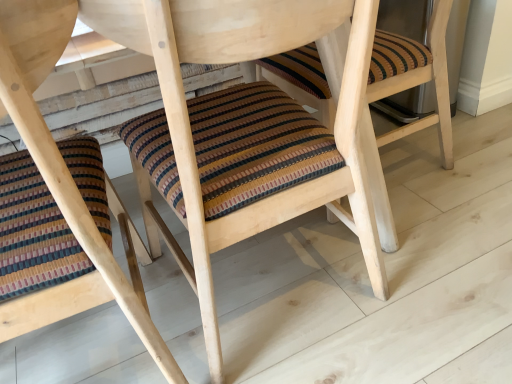
Question: Is striped fabric cushion at lower left, acting as the 2th chair starting from the right, aimed at striped fabric cushion at center, the 2th chair when ordered from left to right?

Choices:
 (A) yes
 (B) no

Answer: (B)

Question: From a real-world perspective, is striped fabric cushion at lower left, positioned as the 1th chair in left-to-right order, located beneath striped fabric cushion at center, which is counted as the 1th chair, starting from the right?

Choices:
 (A) yes
 (B) no

Answer: (B)

Question: Does striped fabric cushion at lower left, acting as the 2th chair starting from the right, have a lesser width compared to striped fabric cushion at center, which is counted as the 1th chair, starting from the right?

Choices:
 (A) no
 (B) yes

Answer: (A)

Question: Does striped fabric cushion at lower left, positioned as the 1th chair in left-to-right order, appear on the left side of striped fabric cushion at center, the 2th chair when ordered from left to right?

Choices:
 (A) yes
 (B) no

Answer: (A)

Question: Is striped fabric cushion at lower left, acting as the 2th chair starting from the right, turned away from striped fabric cushion at center, which is counted as the 1th chair, starting from the right?

Choices:
 (A) yes
 (B) no

Answer: (B)

Question: Is striped fabric cushion at lower left, acting as the 2th chair starting from the right, positioned in front of striped fabric cushion at center, the 2th chair when ordered from left to right?

Choices:
 (A) no
 (B) yes

Answer: (B)

Question: Considering the relative sizes of striped fabric cushion at center, the 2th chair when ordered from left to right, and striped fabric cushion at lower left, acting as the 2th chair starting from the right, in the image provided, is striped fabric cushion at center, the 2th chair when ordered from left to right, shorter than striped fabric cushion at lower left, acting as the 2th chair starting from the right,?

Choices:
 (A) yes
 (B) no

Answer: (A)

Question: Does striped fabric cushion at center, which is counted as the 1th chair, starting from the right, have a greater height compared to striped fabric cushion at lower left, acting as the 2th chair starting from the right?

Choices:
 (A) no
 (B) yes

Answer: (A)

Question: Is striped fabric cushion at center, the 2th chair when ordered from left to right, looking in the opposite direction of striped fabric cushion at lower left, positioned as the 1th chair in left-to-right order?

Choices:
 (A) yes
 (B) no

Answer: (B)

Question: From a real-world perspective, is striped fabric cushion at center, the 2th chair when ordered from left to right, located higher than striped fabric cushion at lower left, positioned as the 1th chair in left-to-right order?

Choices:
 (A) yes
 (B) no

Answer: (B)

Question: Is striped fabric cushion at center, which is counted as the 1th chair, starting from the right, located outside striped fabric cushion at lower left, acting as the 2th chair starting from the right?

Choices:
 (A) yes
 (B) no

Answer: (A)

Question: Is striped fabric cushion at center, which is counted as the 1th chair, starting from the right, directly adjacent to striped fabric cushion at lower left, positioned as the 1th chair in left-to-right order?

Choices:
 (A) yes
 (B) no

Answer: (B)

Question: Considering the positions of striped fabric cushion at center, which is counted as the 1th chair, starting from the right, and striped fabric cushion at lower left, positioned as the 1th chair in left-to-right order, in the image, is striped fabric cushion at center, which is counted as the 1th chair, starting from the right, taller or shorter than striped fabric cushion at lower left, positioned as the 1th chair in left-to-right order,?

Choices:
 (A) tall
 (B) short

Answer: (B)